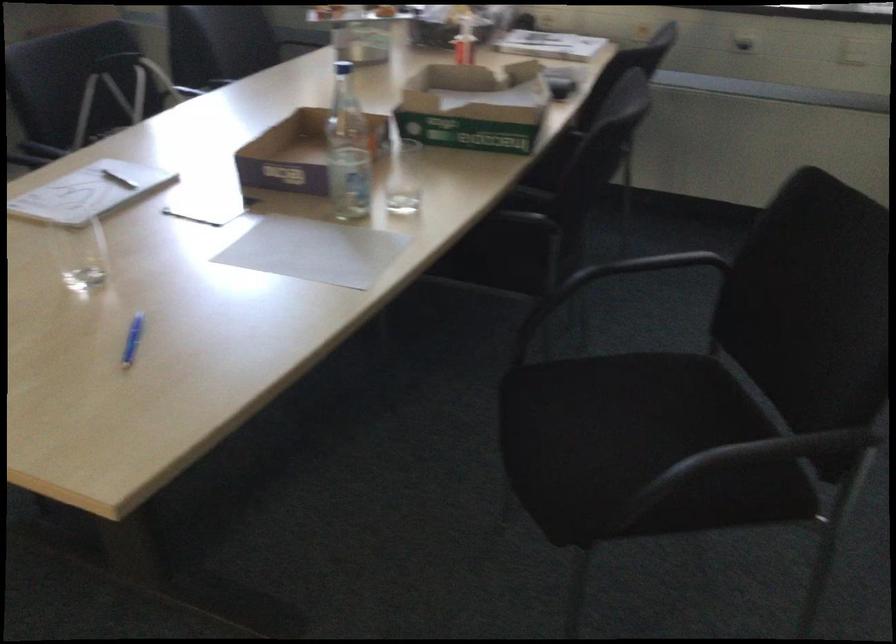
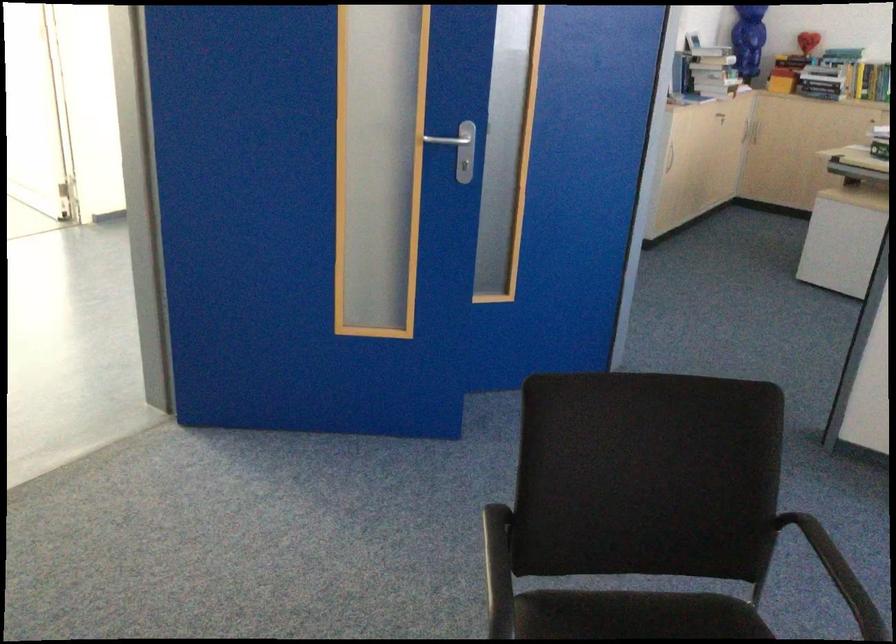
First-person continuous shooting, in which direction is the camera rotating?

The camera rotated toward left-down.